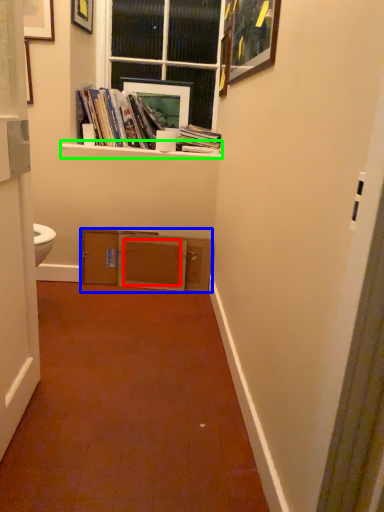
Question: Based on their relative distances, which object is farther from drawer (highlighted by a red box)? Choose from cabinetry (highlighted by a blue box) and window sill (highlighted by a green box).

Choices:
 (A) cabinetry
 (B) window sill

Answer: (B)